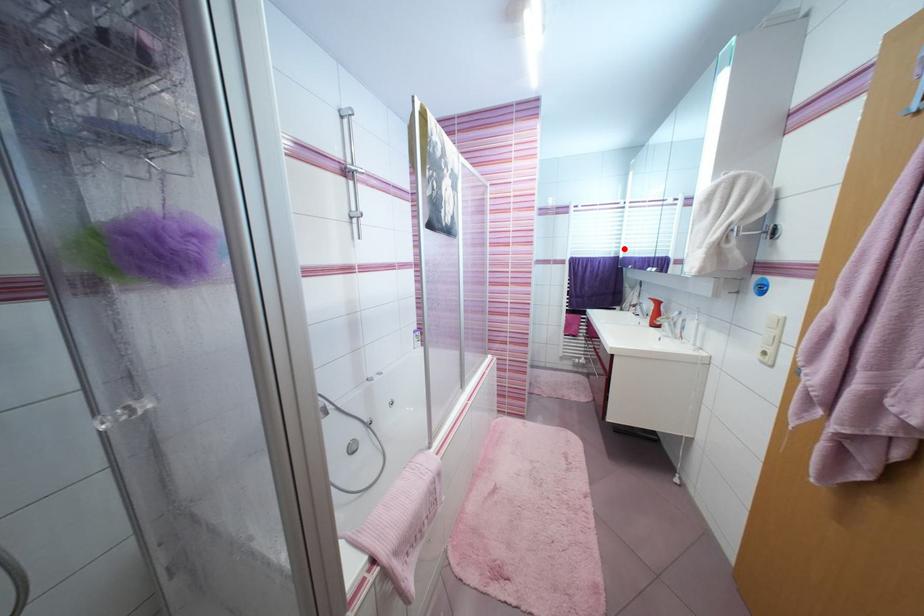
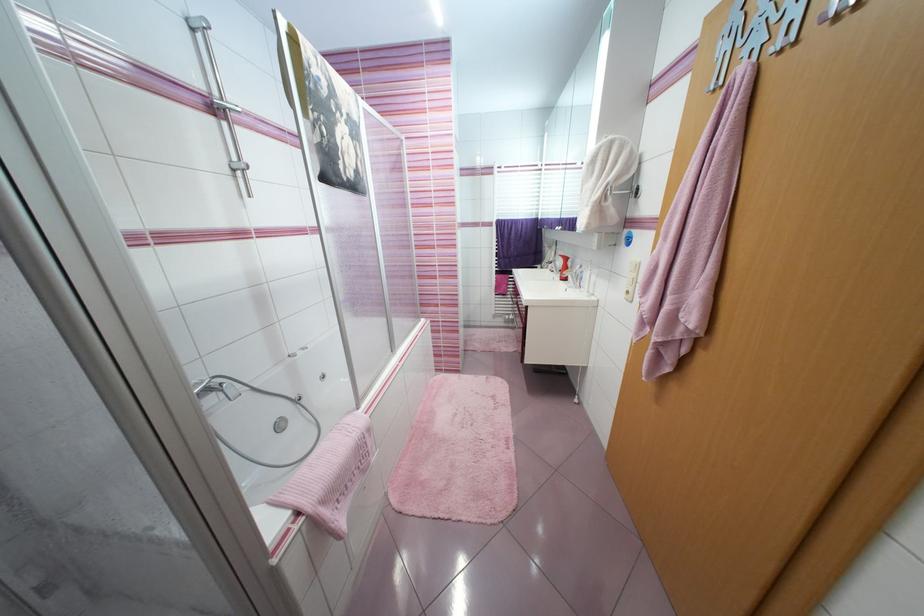
Locate, in the second image, the point that corresponds to the highlighted location in the first image.

(543, 211)